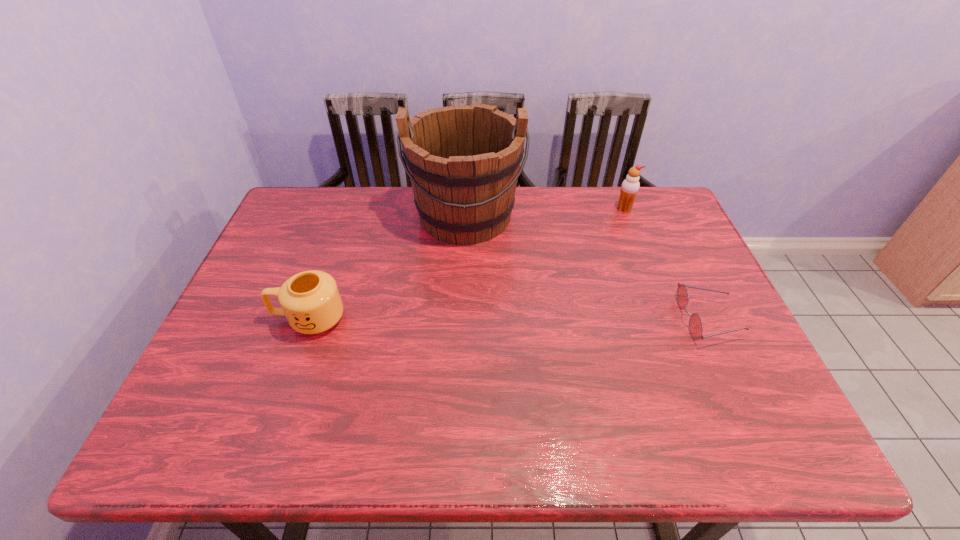
What are the coordinates of `the second shortest object` in the screenshot? It's located at (310, 300).

What are the coordinates of `the leftmost object` in the screenshot? It's located at (310, 300).

Identify the location of the rightmost object. (695, 323).

In order to click on the shortest object in this screenshot , I will do `click(695, 323)`.

Find the location of a particular element. The width and height of the screenshot is (960, 540). icecream is located at coordinates (630, 186).

You are a GUI agent. You are given a task and a screenshot of the screen. Output one action in this format:
    pyautogui.click(x=<x>, y=<y>)
    Task: Click on the third object from left to right
    The width and height of the screenshot is (960, 540).
    Given the screenshot: What is the action you would take?
    pyautogui.click(x=630, y=186)

The height and width of the screenshot is (540, 960). What are the coordinates of `the tallest object` in the screenshot? It's located at pyautogui.click(x=463, y=161).

You are a GUI agent. You are given a task and a screenshot of the screen. Output one action in this format:
    pyautogui.click(x=<x>, y=<y>)
    Task: Click on the second object from left to right
    The image size is (960, 540).
    Given the screenshot: What is the action you would take?
    pyautogui.click(x=463, y=161)

Locate an element on the screen. The height and width of the screenshot is (540, 960). vacant region located on the handle side of the second shortest object is located at coordinates (233, 319).

You are a GUI agent. You are given a task and a screenshot of the screen. Output one action in this format:
    pyautogui.click(x=<x>, y=<y>)
    Task: Click on the free space located 0.070m on the handle side of the second shortest object
    This screenshot has width=960, height=540.
    Given the screenshot: What is the action you would take?
    pyautogui.click(x=246, y=319)